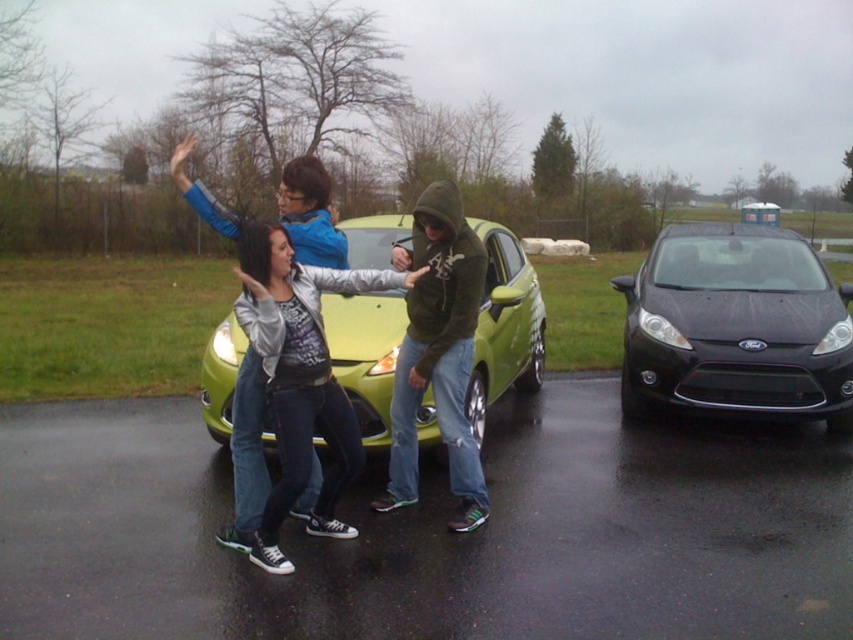
Question: Which point is farther from the camera taking this photo?

Choices:
 (A) (747, 384)
 (B) (351, 369)
 (C) (393, 442)

Answer: (A)

Question: Is green matte hatchback at center positioned in front of denim jacket at center?

Choices:
 (A) yes
 (B) no

Answer: (B)

Question: In this image, where is green matte hatchback at center located relative to denim jacket at center?

Choices:
 (A) left
 (B) right

Answer: (B)

Question: Does green matte hatchback at center have a smaller size compared to dark green hoodie at center?

Choices:
 (A) yes
 (B) no

Answer: (B)

Question: Among these points, which one is farthest from the camera?

Choices:
 (A) (386, 262)
 (B) (688, 326)

Answer: (B)

Question: Which of these objects is positioned farthest from the green matte hatchback at center?

Choices:
 (A) black matte ford fiesta at center
 (B) denim jacket at center

Answer: (B)